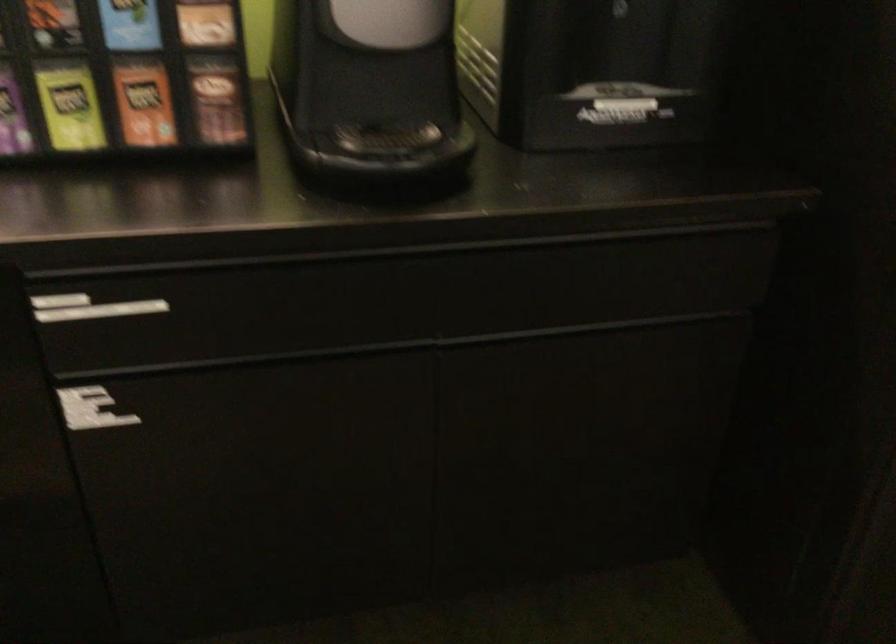
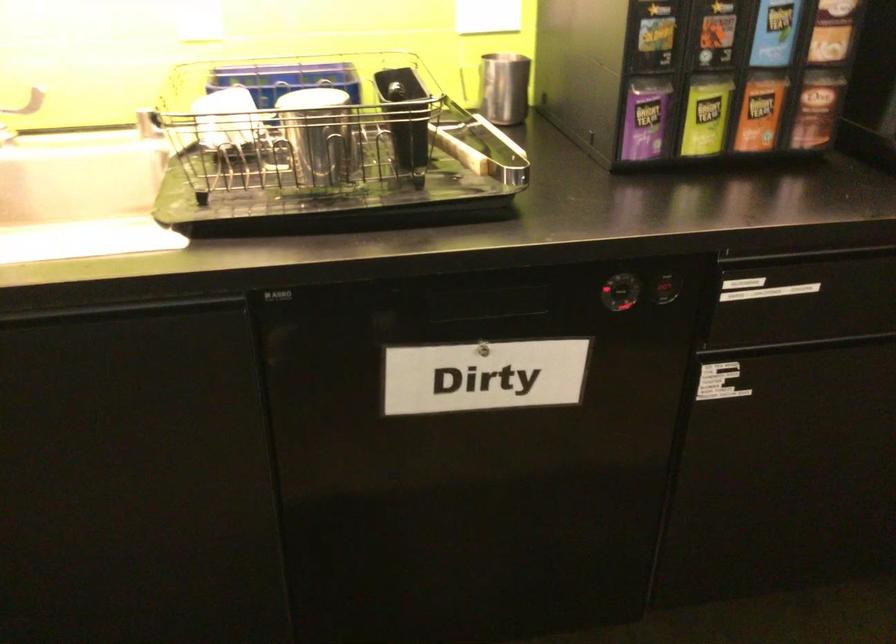
The point at (73,106) is marked in the first image. Where is the corresponding point in the second image?

(705, 116)